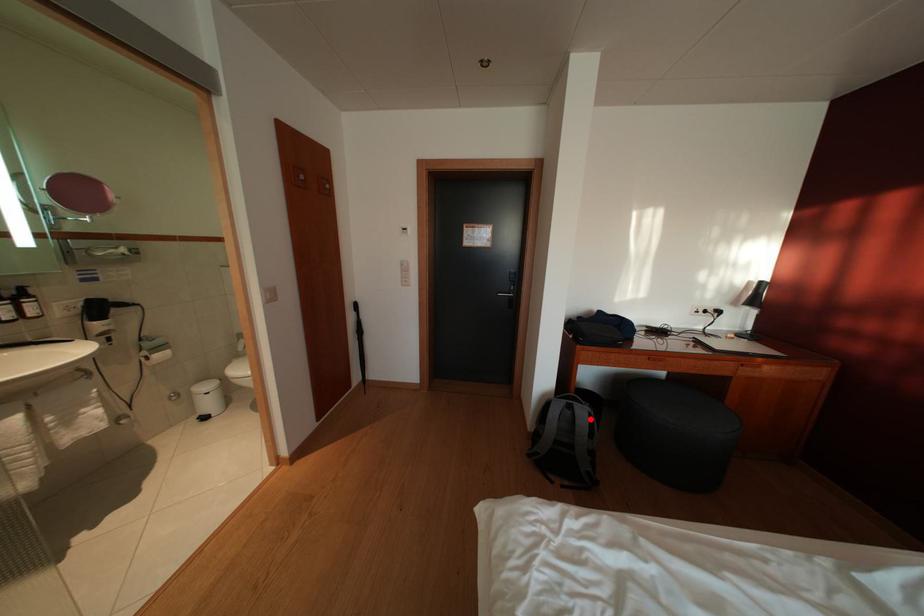
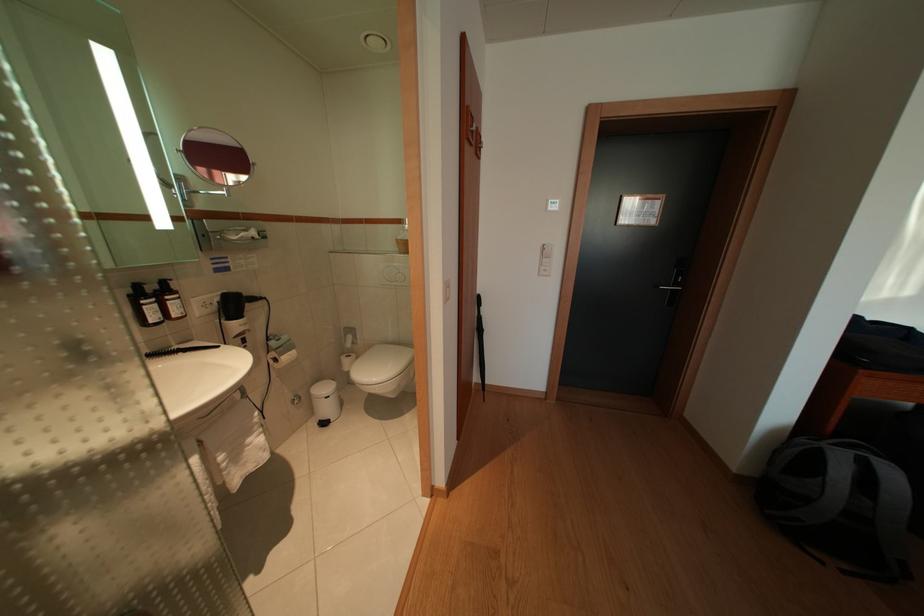
Question: I am providing you with two images of the same scene from different viewpoints. Image1 has a red point marked. In image2, the corresponding 3D location appears at what relative position? Reply with the corresponding letter.

Choices:
 (A) Closer
 (B) Farther

Answer: (B)